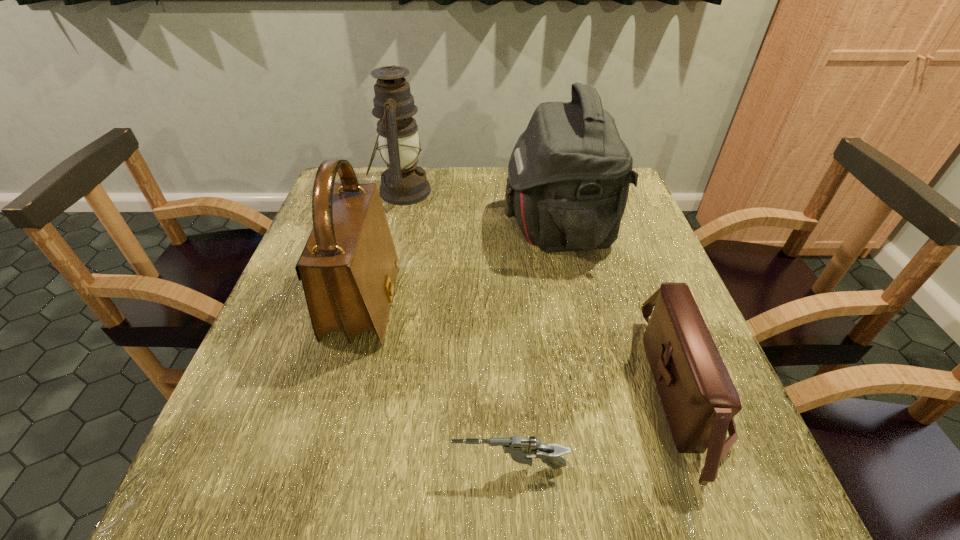
I want to click on object present at the near right corner, so click(x=699, y=398).

Find the location of `vacant space at the far edge of the desktop`. vacant space at the far edge of the desktop is located at coordinates (477, 198).

Locate an element on the screen. Image resolution: width=960 pixels, height=540 pixels. vacant space at the near edge of the desktop is located at coordinates (346, 508).

This screenshot has height=540, width=960. What are the coordinates of `free space at the right edge of the desktop` in the screenshot? It's located at (639, 245).

Locate an element on the screen. The height and width of the screenshot is (540, 960). free space between the shortest object and the leftmost shoulder bag is located at coordinates (437, 386).

The width and height of the screenshot is (960, 540). What are the coordinates of `empty space between the shortest object and the oil lamp` in the screenshot? It's located at (456, 329).

The image size is (960, 540). What are the coordinates of `empty space between the gun and the leftmost shoulder bag` in the screenshot? It's located at (437, 386).

This screenshot has height=540, width=960. I want to click on vacant area that lies between the oil lamp and the shortest shoulder bag, so click(542, 292).

Locate an element on the screen. The width and height of the screenshot is (960, 540). the third closest object relative to the shortest shoulder bag is located at coordinates (348, 268).

Find the location of a particular element. The image size is (960, 540). object that is the closest one to the fourth tallest object is located at coordinates (569, 173).